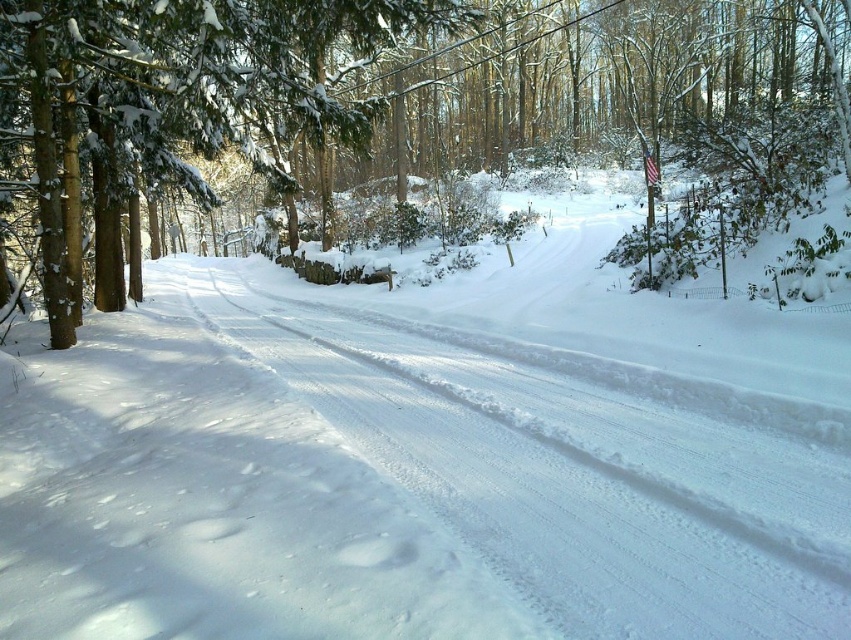
You are standing at the point marked as point (572, 477) in the winter scene. What is the terrain like under your feet?

The terrain under your feet at point (572, 477) is white snow trail at center, which is thick and pristine, as described in the scene.